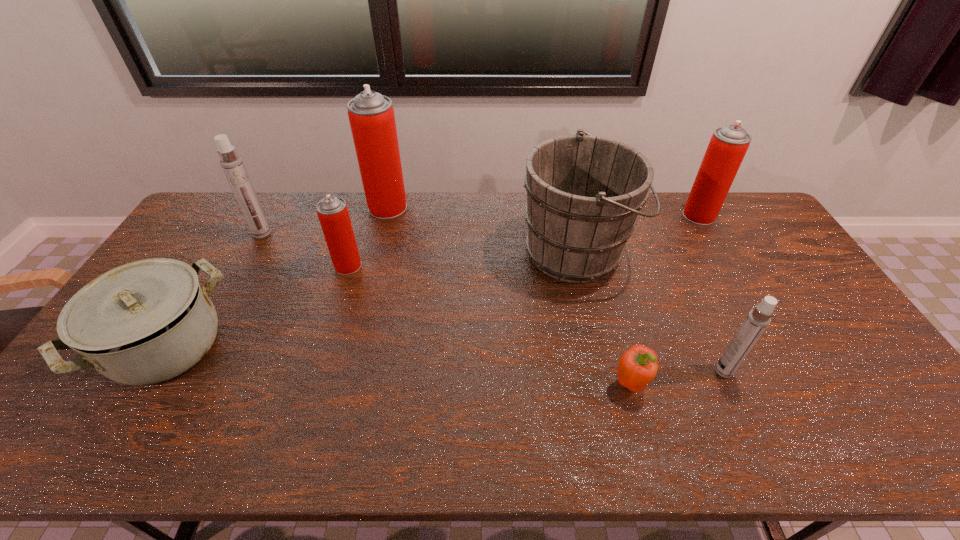
Find the location of `the nearest aerosol can`. the nearest aerosol can is located at coordinates (757, 320).

Where is `the second shortest object`? The height and width of the screenshot is (540, 960). the second shortest object is located at coordinates (144, 322).

Where is `pepper`? The width and height of the screenshot is (960, 540). pepper is located at coordinates (637, 367).

Locate an element on the screen. Image resolution: width=960 pixels, height=540 pixels. the shortest object is located at coordinates (637, 367).

Where is `vacant region located on the front of the tallest object`? The image size is (960, 540). vacant region located on the front of the tallest object is located at coordinates (372, 270).

Where is `vacant space located on the left of the rightmost red aerosol can`? The height and width of the screenshot is (540, 960). vacant space located on the left of the rightmost red aerosol can is located at coordinates (659, 215).

Where is `vacant space located on the back of the farther white aerosol can`? vacant space located on the back of the farther white aerosol can is located at coordinates (271, 217).

Where is `vacant position located on the handle side of the bucket`? The height and width of the screenshot is (540, 960). vacant position located on the handle side of the bucket is located at coordinates (690, 252).

Locate an element on the screen. The height and width of the screenshot is (540, 960). vacant space situated on the front of the second nearest aerosol can is located at coordinates (316, 371).

Locate an element on the screen. This screenshot has width=960, height=540. free location located 0.290m on the back of the second object from right to left is located at coordinates (684, 284).